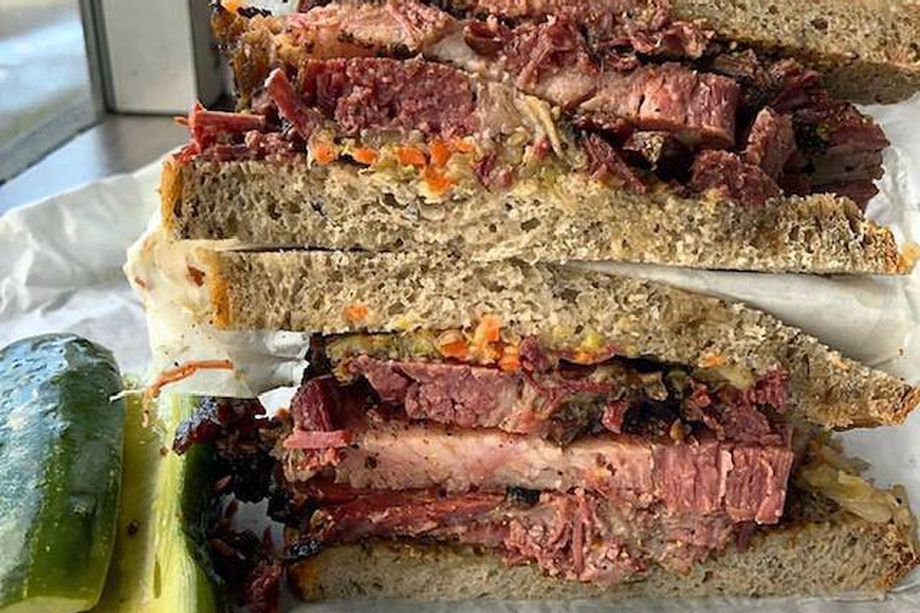
You are a GUI agent. You are given a task and a screenshot of the screen. Output one action in this format:
    pyautogui.click(x=<x>, y=<y>)
    Task: Click on the window
    The width and height of the screenshot is (920, 613).
    Given the screenshot: What is the action you would take?
    pyautogui.click(x=41, y=80)